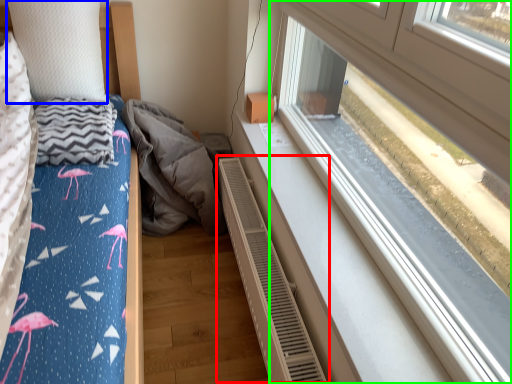
Question: Based on their relative distances, which object is nearer to air conditioner (highlighted by a red box)? Choose from pillow (highlighted by a blue box) and window (highlighted by a green box).

Choices:
 (A) pillow
 (B) window

Answer: (B)